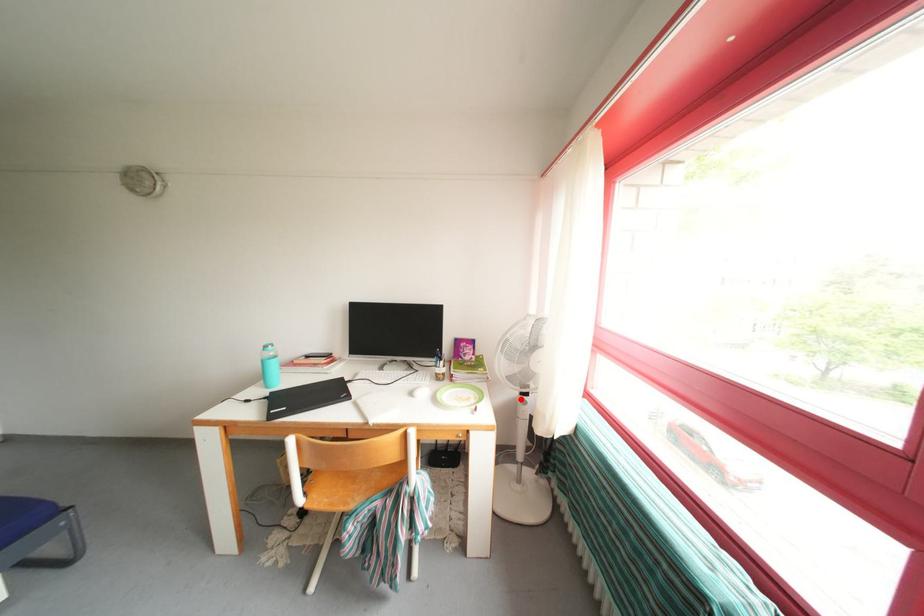
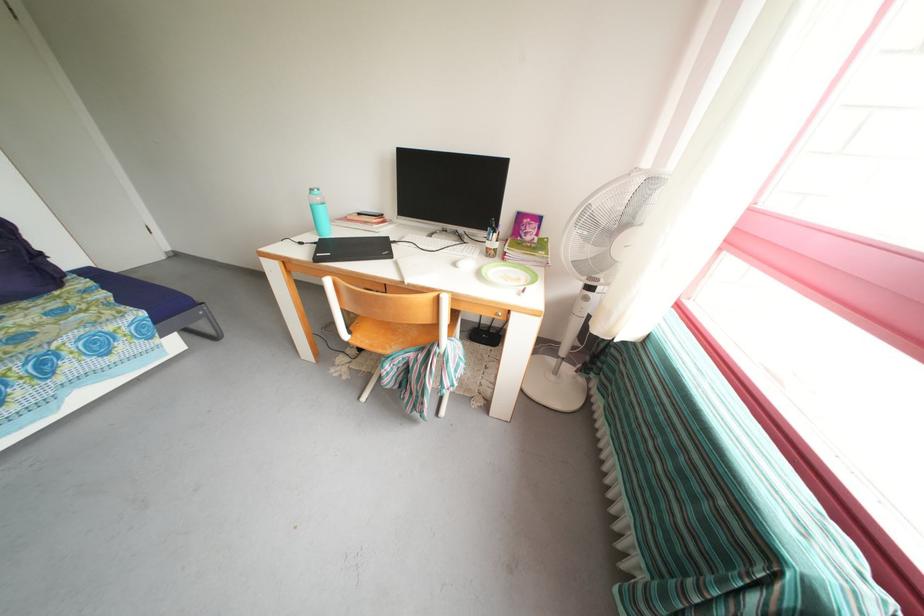
In the second image, find the point that corresponds to the highlighted location in the first image.

(582, 293)